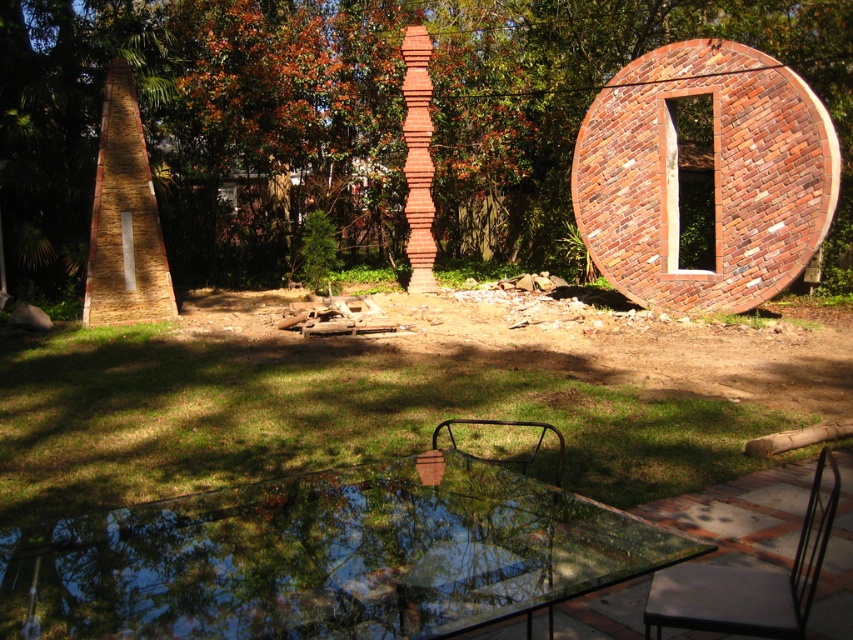
Question: Which object is closer to the camera taking this photo?

Choices:
 (A) black metal chair at lower center
 (B) green leafy tree at upper center
 (C) metallic black chair at lower right
 (D) transparent glass table at center

Answer: (D)

Question: Is green leafy tree at upper center above metallic black chair at lower right?

Choices:
 (A) no
 (B) yes

Answer: (B)

Question: Which object appears farthest from the camera in this image?

Choices:
 (A) green leafy tree at upper center
 (B) black metal chair at lower center

Answer: (A)

Question: Among these points, which one is nearest to the camera?

Choices:
 (A) (584, 81)
 (B) (579, 531)

Answer: (B)

Question: Where is transparent glass table at center located in relation to black metal chair at lower center in the image?

Choices:
 (A) above
 (B) below

Answer: (A)

Question: Can you confirm if green leafy tree at upper center is wider than black metal chair at lower center?

Choices:
 (A) no
 (B) yes

Answer: (B)